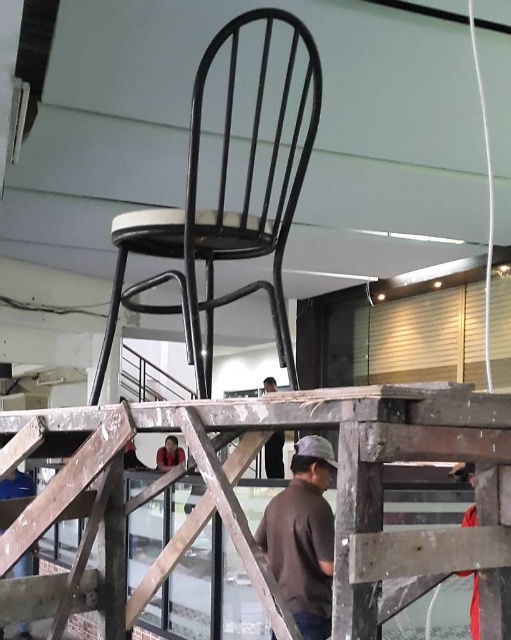
You are an interior designer inspecting the construction site. You notice the blue fabric at lower left and the black leather jacket at center. Which object is located closer to the floor?

The blue fabric at lower left is positioned under the black leather jacket at center, so it is closer to the floor.

You are an interior designer assessing the space. You notice the brown cotton shirt at lower center and the blue fabric at lower left. Which item takes up more space in the scene?

The brown cotton shirt at lower center takes up more space in the scene because it is bigger than the blue fabric at lower left.

You are a delivery person carrying a package that is 10 feet long. You need to place it between the blue fabric at lower left and the black leather jacket at center. Is there enough space between them to fit the package?

The blue fabric at lower left and the black leather jacket at center are 9.29 feet apart from each other. Since the package is 10 feet long, it will not fit between them as the distance is shorter than the package length.